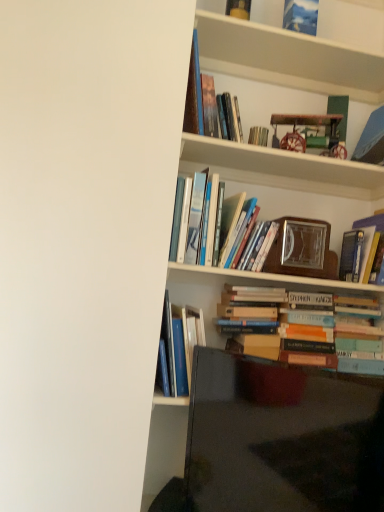
Locate an element on the screen. free point behind metallic silver book at upper center, marked as the 3th book in a top-to-bottom arrangement is located at coordinates [x=254, y=163].